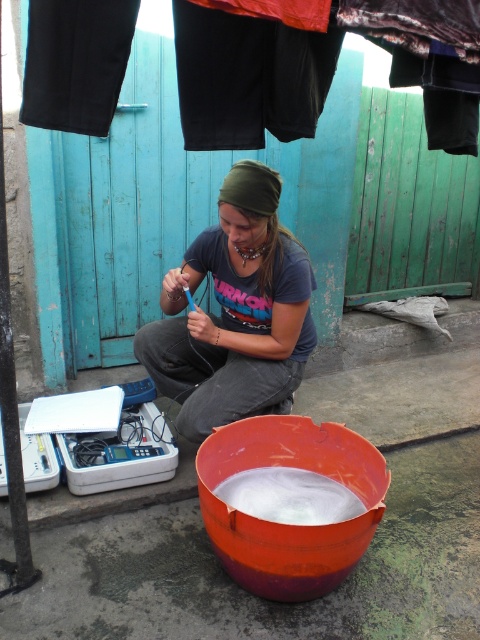
Question: Which object appears closest to the camera in this image?

Choices:
 (A) white frothy substance at lower center
 (B) black cotton pants at upper center
 (C) orange plastic bucket at lower center

Answer: (B)

Question: Is orange plastic bucket at lower center closer to camera compared to matte orange bowl at center?

Choices:
 (A) no
 (B) yes

Answer: (A)

Question: Can you confirm if orange plastic bucket at lower center is thinner than matte gray shirt at center?

Choices:
 (A) no
 (B) yes

Answer: (A)

Question: Which of the following is the closest to the observer?

Choices:
 (A) matte orange bowl at center
 (B) orange plastic bucket at lower center

Answer: (A)

Question: Can you confirm if matte gray shirt at center is positioned below matte orange bowl at center?

Choices:
 (A) yes
 (B) no

Answer: (B)

Question: Which point appears farthest from the camera in this image?

Choices:
 (A) (201, 17)
 (B) (383, 552)
 (C) (322, 518)
 (D) (252, 531)

Answer: (B)